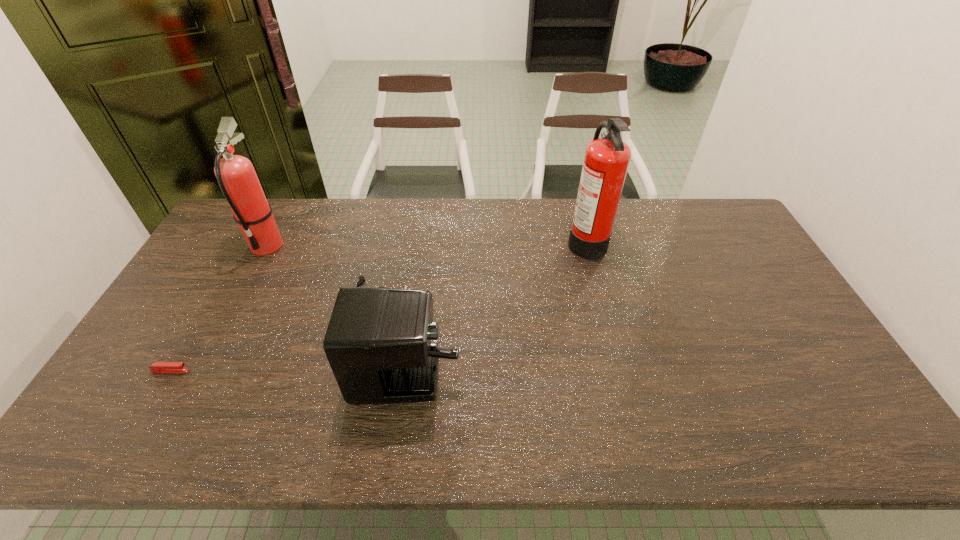
What are the coordinates of `vacant region between the right fire extinguisher and the left fire extinguisher` in the screenshot? It's located at (x=426, y=242).

This screenshot has height=540, width=960. I want to click on vacant area that lies between the third object from left to right and the left fire extinguisher, so click(331, 289).

Identify the location of empty space that is in between the left fire extinguisher and the coffee maker. The height and width of the screenshot is (540, 960). (331, 289).

I want to click on unoccupied position between the coffee maker and the shortest object, so click(x=283, y=353).

The width and height of the screenshot is (960, 540). In order to click on unoccupied position between the left fire extinguisher and the right fire extinguisher in this screenshot , I will do `click(426, 242)`.

This screenshot has height=540, width=960. In order to click on empty space between the left fire extinguisher and the shortest object in this screenshot , I will do `click(219, 308)`.

Select which object appears as the closest to the left fire extinguisher. Please provide its 2D coordinates. Your answer should be formatted as a tuple, i.e. [(x, y)], where the tuple contains the x and y coordinates of a point satisfying the conditions above.

[(378, 342)]

Identify the location of object that stands as the third closest to the right fire extinguisher. The height and width of the screenshot is (540, 960). (158, 367).

Find the location of a particular element. The width and height of the screenshot is (960, 540). vacant space that satisfies the following two spatial constraints: 1. on the front-facing side of the rightmost object; 2. on the hose direction of the left fire extinguisher is located at coordinates (588, 245).